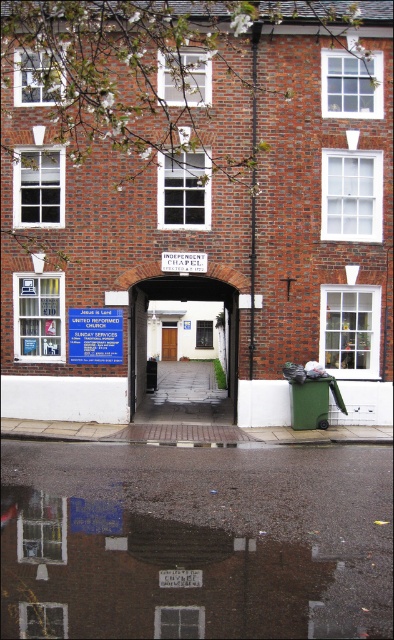
Is white wooden door at center further to camera compared to blue plastic sign at center?

Yes.

Does white wooden door at center appear on the left side of blue plastic sign at center?

No, white wooden door at center is not to the left of blue plastic sign at center.

Where is `white wooden door at center`? This screenshot has width=394, height=640. white wooden door at center is located at coordinates (185, 301).